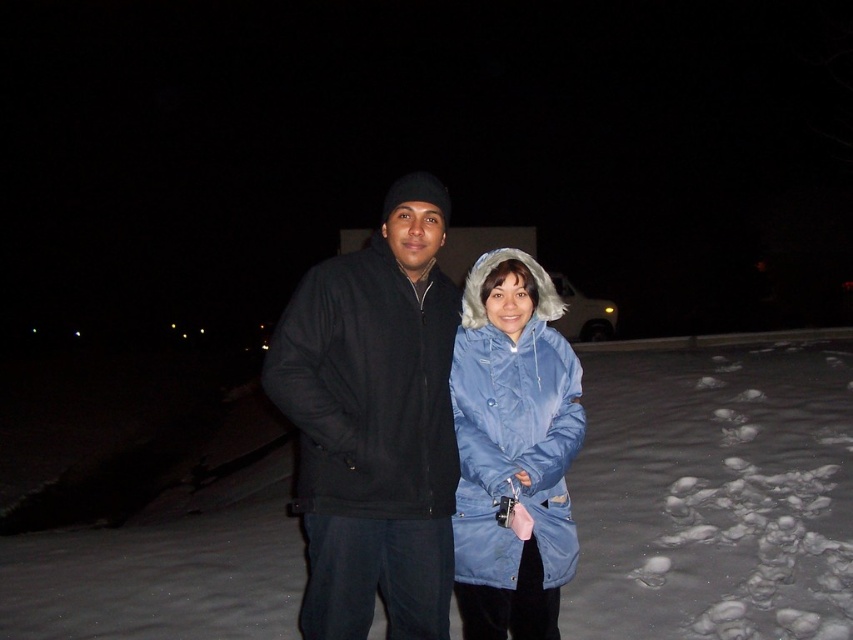
You are a photographer trying to capture a clear shot of both the white fluffy snow at center and the blue matte coat at center. Since the camera focuses on the object it detects first, which object should you adjust your focus to ensure both are in focus?

The white fluffy snow at center is positioned on the right side of blue matte coat at center. To ensure both are in focus, adjust the focus on the blue matte coat at center first since it is closer to the camera, then recompose to include the white fluffy snow at center.

You are taking a photo of two people standing in a snowy area at night. Where exactly is the white fluffy snow at center located in the image?

The white fluffy snow at center is located at point coordinates of (714, 492).